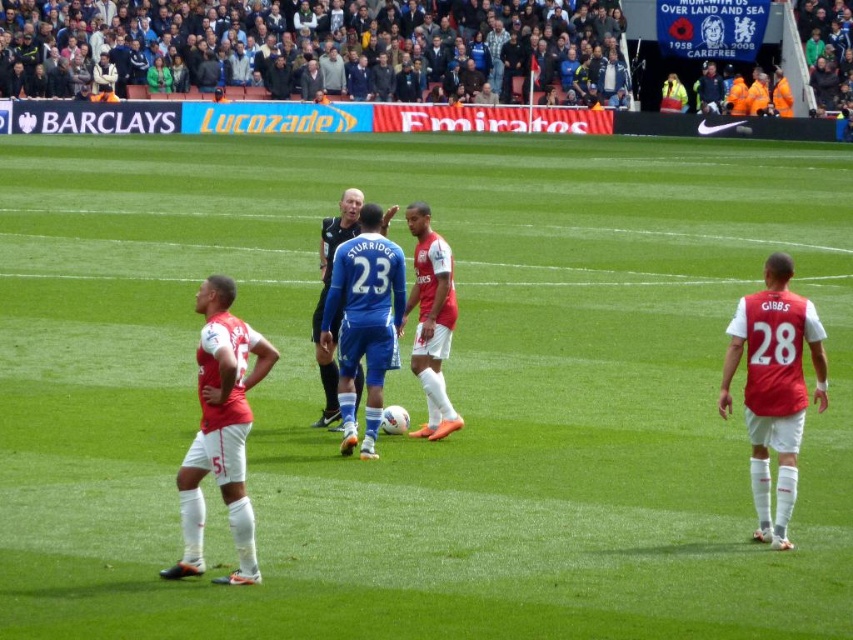
Question: Is matte red soccer player at center positioned at the back of blue fabric jersey at center?

Choices:
 (A) yes
 (B) no

Answer: (B)

Question: Is matte red jersey at right bigger than matte red jersey at left?

Choices:
 (A) no
 (B) yes

Answer: (B)

Question: Considering the real-world distances, which object is farthest from the matte red jersey at left?

Choices:
 (A) matte red soccer player at center
 (B) blue fabric jersey at center
 (C) matte red jersey at right

Answer: (B)

Question: Which point is farther from the camera taking this photo?

Choices:
 (A) (778, 282)
 (B) (369, 282)

Answer: (B)

Question: Does matte red jersey at right have a lesser width compared to blue fabric jersey at center?

Choices:
 (A) yes
 (B) no

Answer: (B)

Question: Which of the following is the farthest from the observer?

Choices:
 (A) blue fabric jersey at center
 (B) blue smooth jersey at center

Answer: (A)